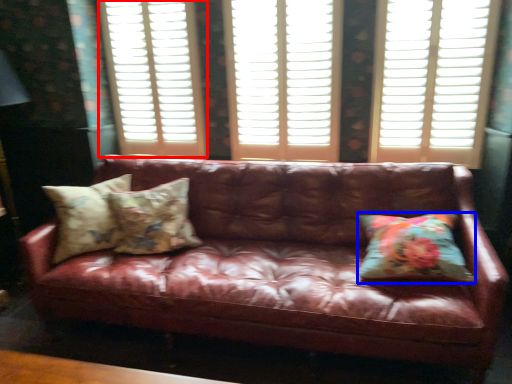
Question: Which point is further to the camera, window frame (highlighted by a red box) or pillow (highlighted by a blue box)?

Choices:
 (A) window frame
 (B) pillow

Answer: (A)